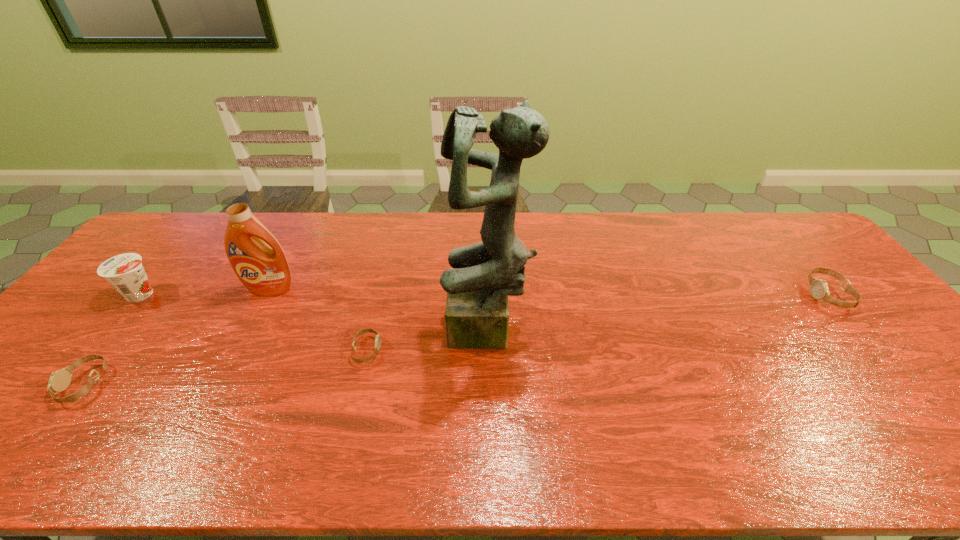
Find the location of a particular element. The height and width of the screenshot is (540, 960). free point between the tallest object and the fifth shortest object is located at coordinates (379, 311).

Locate an element on the screen. The height and width of the screenshot is (540, 960). free space that is in between the fourth object from left to right and the yogurt is located at coordinates (254, 322).

Where is `free spot between the tallest object and the fifth tallest object`? free spot between the tallest object and the fifth tallest object is located at coordinates (286, 359).

Locate an element on the screen. Image resolution: width=960 pixels, height=540 pixels. object that is the nearest to the second shortest object is located at coordinates (125, 272).

This screenshot has height=540, width=960. Find the location of `object that ranks as the third closest to the sculpture`. object that ranks as the third closest to the sculpture is located at coordinates (59, 380).

Select which watch is the closest to the rightmost watch. Please provide its 2D coordinates. Your answer should be formatted as a tuple, i.e. [(x, y)], where the tuple contains the x and y coordinates of a point satisfying the conditions above.

[(368, 330)]

Select which watch appears as the second closest to the fifth shortest object. Please provide its 2D coordinates. Your answer should be formatted as a tuple, i.e. [(x, y)], where the tuple contains the x and y coordinates of a point satisfying the conditions above.

[(59, 380)]

Identify the location of vacant region that satisfies the following two spatial constraints: 1. on the front-facing side of the second tallest object; 2. on the face of the second tallest watch. The height and width of the screenshot is (540, 960). (220, 384).